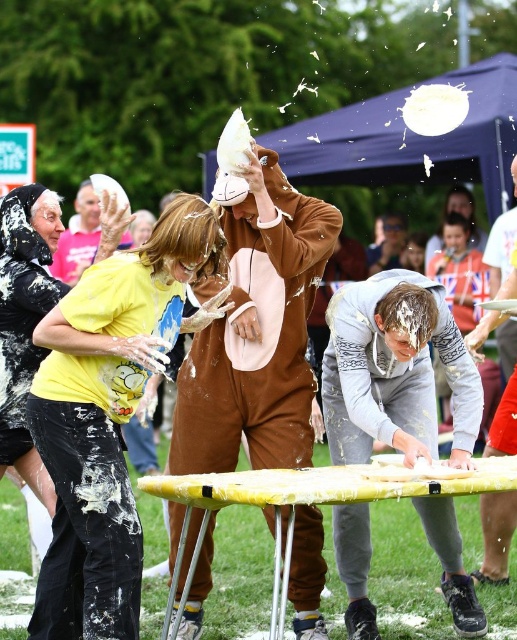
You are a photographer at the pie event and want to capture a photo that includes both the white plastic plate at lower right and the yellow cotton shirt at upper left. Which object should be placed on the right side of the frame to ensure both are visible?

The white plastic plate at lower right should be placed on the right side of the frame since it is already positioned on the right side of the yellow cotton shirt at upper left.

You are a participant in the pie throwing event and you want to place a new pie on the ground near the white plastic plate at lower right. Where exactly should you place it?

The white plastic plate at lower right is located at coordinates point [495,536], so you should place the new pie near that point.